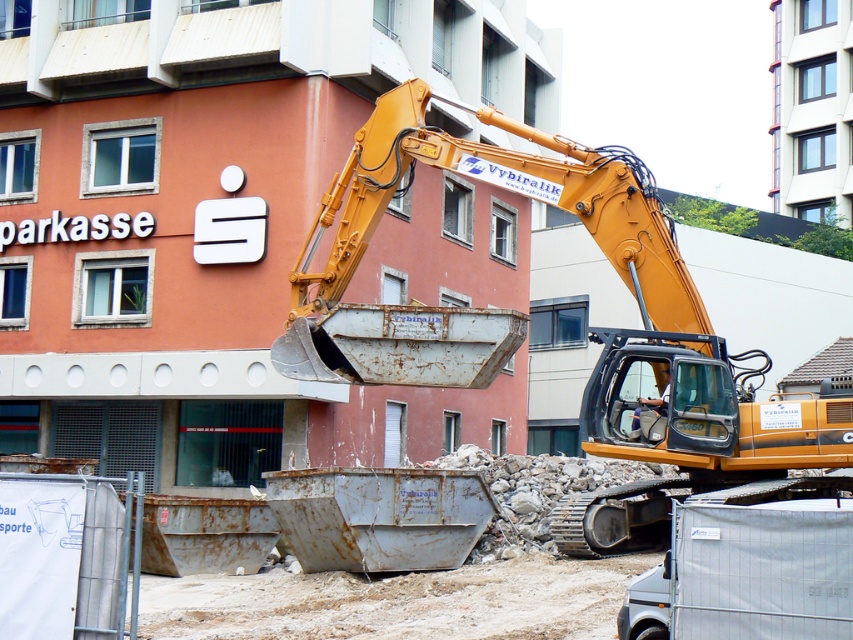
Is yellow metallic excavator at center wider than light brown leather helmet at center?

Correct, the width of yellow metallic excavator at center exceeds that of light brown leather helmet at center.

Describe the element at coordinates (525, 321) in the screenshot. Image resolution: width=853 pixels, height=640 pixels. I see `yellow metallic excavator at center` at that location.

Based on the photo, who is more forward, (743, 460) or (666, 392)?

Point (743, 460) is in front.

Identify the location of yellow metallic excavator at center. Image resolution: width=853 pixels, height=640 pixels. (525, 321).